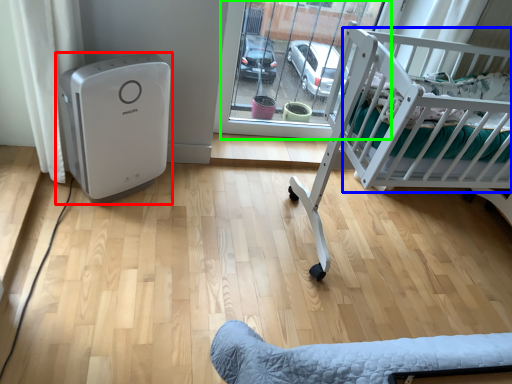
Question: Which object is positioned farthest from home appliance (highlighted by a red box)? Select from infant bed (highlighted by a blue box) and glass door (highlighted by a green box).

Choices:
 (A) infant bed
 (B) glass door

Answer: (A)